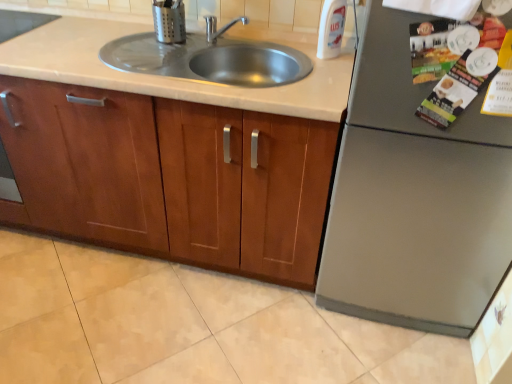
Describe the element at coordinates (170, 177) in the screenshot. I see `wooden cabinet at center` at that location.

The height and width of the screenshot is (384, 512). I want to click on matte plastic magazine at upper right, so click(455, 90).

This screenshot has height=384, width=512. I want to click on stainless steel sink at center, so click(x=209, y=59).

Where is `wooden cabinet at center`? This screenshot has height=384, width=512. wooden cabinet at center is located at coordinates (170, 177).

How far apart are stainless steel sink at center and white plastic bottle at upper right?

The distance of stainless steel sink at center from white plastic bottle at upper right is 14.57 inches.

Is stainless steel sink at center touching white plastic bottle at upper right?

No, stainless steel sink at center is not making contact with white plastic bottle at upper right.

From a real-world perspective, is stainless steel sink at center below white plastic bottle at upper right?

Indeed, from a real-world perspective, stainless steel sink at center is positioned beneath white plastic bottle at upper right.

Does stainless steel sink at center have a smaller size compared to white plastic bottle at upper right?

Incorrect, stainless steel sink at center is not smaller in size than white plastic bottle at upper right.

Considering the positions of objects wooden cabinet at center and beige tile floor at lower center in the image provided, who is more to the left, wooden cabinet at center or beige tile floor at lower center?

wooden cabinet at center is more to the left.

How distant is wooden cabinet at center from beige tile floor at lower center?

wooden cabinet at center and beige tile floor at lower center are 16.48 inches apart.

Does wooden cabinet at center have a lesser width compared to beige tile floor at lower center?

Indeed, wooden cabinet at center has a lesser width compared to beige tile floor at lower center.

Can you confirm if wooden cabinet at center is smaller than beige tile floor at lower center?

Incorrect, wooden cabinet at center is not smaller in size than beige tile floor at lower center.

Considering the positions of point (283, 80) and point (57, 265), is point (283, 80) closer or farther from the camera than point (57, 265)?

Clearly, point (283, 80) is closer to the camera than point (57, 265).

In order to click on granite below the stainless steel sink at center (from a real-world perspective) in this screenshot , I will do `click(189, 326)`.

From the image's perspective, is stainless steel sink at center below beige tile floor at lower center?

No, from the image's perspective, stainless steel sink at center is not below beige tile floor at lower center.

From a real-world perspective, which object stands above the other?

satin silver refrigerator at right, the 2th appliance in the back-to-front sequence, is physically above.

Does point (466, 124) come closer to viewer compared to point (260, 238)?

Yes, point (466, 124) is in front of point (260, 238).

Is satin silver refrigerator at right, marked as the second appliance in a left-to-right arrangement, directly adjacent to wooden cabinet at center?

satin silver refrigerator at right, marked as the second appliance in a left-to-right arrangement, and wooden cabinet at center are clearly separated.

Find the location of a particular element. appliance in front of the wooden cabinet at center is located at coordinates (414, 197).

Is matte plastic magazine at upper right wider than white plastic bottle at upper right?

No, matte plastic magazine at upper right is not wider than white plastic bottle at upper right.

From a real-world perspective, between matte plastic magazine at upper right and white plastic bottle at upper right, who is vertically higher?

white plastic bottle at upper right.

Considering the positions of objects matte plastic magazine at upper right and white plastic bottle at upper right in the image provided, who is more to the left, matte plastic magazine at upper right or white plastic bottle at upper right?

Positioned to the left is white plastic bottle at upper right.

From the image's perspective, is matte plastic magazine at upper right below white plastic bottle at upper right?

Yes, from the image's perspective, matte plastic magazine at upper right is below white plastic bottle at upper right.

Is matte plastic magazine at upper right inside or outside of wooden cabinet at center?

matte plastic magazine at upper right cannot be found inside wooden cabinet at center.

Based on the photo, which object is closer to the camera, matte plastic magazine at upper right or wooden cabinet at center?

matte plastic magazine at upper right.

Could you tell me if matte plastic magazine at upper right is turned towards wooden cabinet at center?

No, matte plastic magazine at upper right is not turned towards wooden cabinet at center.

Is point (465, 77) closer or farther from the camera than point (229, 144)?

Point (465, 77) is closer to the camera than point (229, 144).

From a real-world perspective, between stainless steel sink at center and matte plastic magazine at upper right, who is vertically lower?

stainless steel sink at center.

Does stainless steel sink at center lie in front of matte plastic magazine at upper right?

No, stainless steel sink at center is behind matte plastic magazine at upper right.

How many degrees apart are the facing directions of stainless steel sink at center and matte plastic magazine at upper right?

There is a 6.33-degree angle between the facing directions of stainless steel sink at center and matte plastic magazine at upper right.

From the image's perspective, does stainless steel sink at center appear lower than matte plastic magazine at upper right?

Incorrect, from the image's perspective, stainless steel sink at center is higher than matte plastic magazine at upper right.

This screenshot has width=512, height=384. I want to click on soap dispenser on the right side of stainless steel sink at center, so click(x=331, y=28).

This screenshot has height=384, width=512. Identify the location of cabinetry lying above the beige tile floor at lower center (from the image's perspective). (170, 177).

Based on their spatial positions, is stainless steel sink at center or matte plastic magazine at upper right further from satin silver refrigerator at right, which ranks as the first appliance in front-to-back order?

stainless steel sink at center.

Looking at the image, which one is located closer to wooden cabinet at center, stainless steel sink at center or beige tile floor at lower center?

stainless steel sink at center lies closer to wooden cabinet at center than the other object.

Estimate the real-world distances between objects in this image. Which object is closer to wooden cabinet at center, white plastic bottle at upper right or beige tile floor at lower center?

Based on the image, beige tile floor at lower center appears to be nearer to wooden cabinet at center.

When comparing their distances from matte plastic magazine at upper right, does stainless steel sink at center or satin silver refrigerator at right, acting as the first appliance starting from the right, seem further?

stainless steel sink at center lies further to matte plastic magazine at upper right than the other object.

From the image, which object appears to be nearer to white plastic bottle at upper right, brushed metal utensil holder at upper center, which appears as the 1th appliance when viewed from the back, or satin silver refrigerator at right, marked as the second appliance in a left-to-right arrangement?

Based on the image, brushed metal utensil holder at upper center, which appears as the 1th appliance when viewed from the back, appears to be nearer to white plastic bottle at upper right.

Considering their positions, is beige tile floor at lower center positioned closer to brushed metal utensil holder at upper center, which is the 1th appliance from top to bottom, than matte plastic magazine at upper right?

Among the two, matte plastic magazine at upper right is located nearer to brushed metal utensil holder at upper center, which is the 1th appliance from top to bottom.

Which object lies further to the anchor point matte plastic magazine at upper right, beige tile floor at lower center or white plastic bottle at upper right?

Based on the image, beige tile floor at lower center appears to be further to matte plastic magazine at upper right.

Which object lies nearer to the anchor point wooden cabinet at center, satin silver refrigerator at right, acting as the first appliance starting from the right, or white plastic bottle at upper right?

The object closer to wooden cabinet at center is satin silver refrigerator at right, acting as the first appliance starting from the right.

Locate an element on the screen. This screenshot has height=384, width=512. cabinetry that lies between white plastic bottle at upper right and beige tile floor at lower center from top to bottom is located at coordinates (170, 177).

This screenshot has width=512, height=384. I want to click on sink that lies between brushed metal utensil holder at upper center, which appears as the 1th appliance when viewed from the back, and beige tile floor at lower center from top to bottom, so click(209, 59).

Find the location of a particular element. The width and height of the screenshot is (512, 384). appliance situated between wooden cabinet at center and matte plastic magazine at upper right from left to right is located at coordinates (169, 21).

At what (x,y) coordinates should I click in order to perform the action: click on magazine between stainless steel sink at center and beige tile floor at lower center from top to bottom. Please return your answer as a coordinate pair (x, y). Looking at the image, I should click on (455, 90).